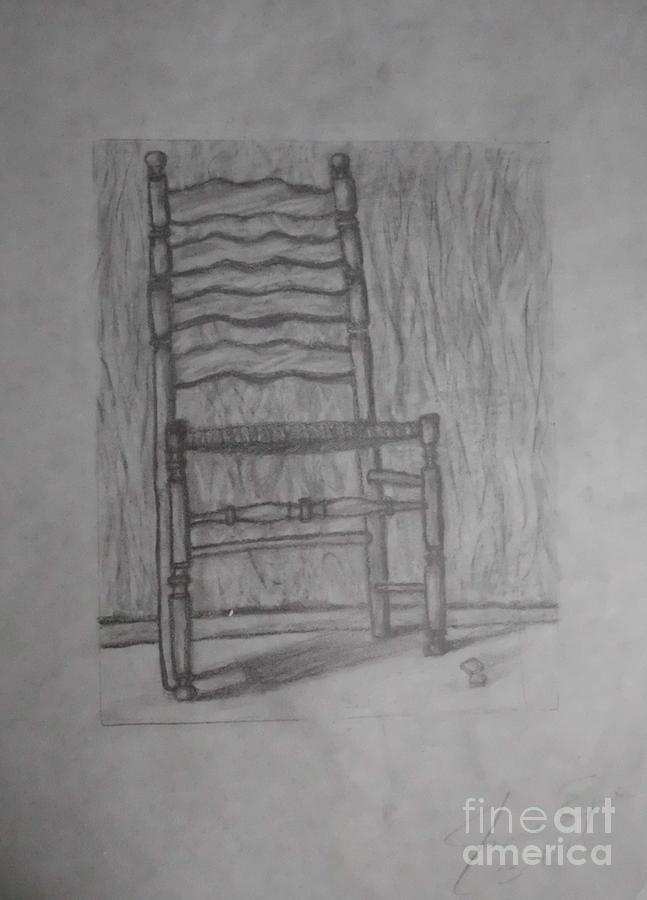
This screenshot has width=647, height=900. In order to click on rounded top of chair back in this screenshot , I will do `click(154, 153)`.